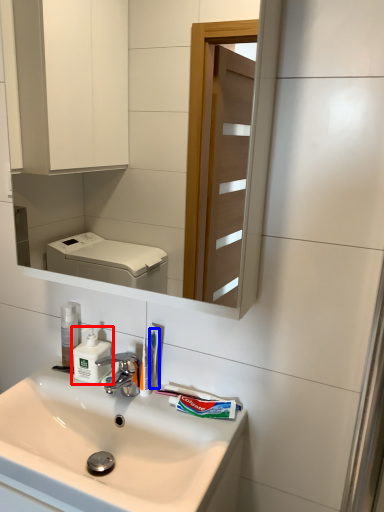
Question: Which object appears closest to the camera in this image, soap dispenser (highlighted by a red box) or toothbrush (highlighted by a blue box)?

Choices:
 (A) soap dispenser
 (B) toothbrush

Answer: (B)